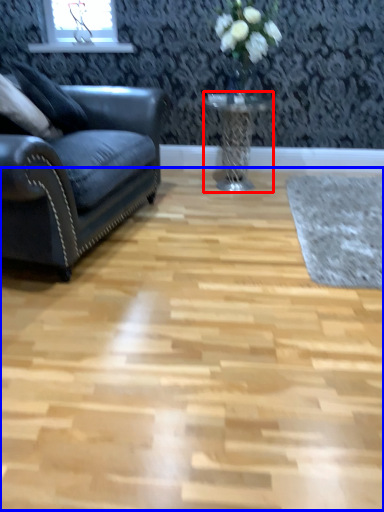
Question: Which object appears closest to the camera in this image, table (highlighted by a red box) or plain (highlighted by a blue box)?

Choices:
 (A) table
 (B) plain

Answer: (B)